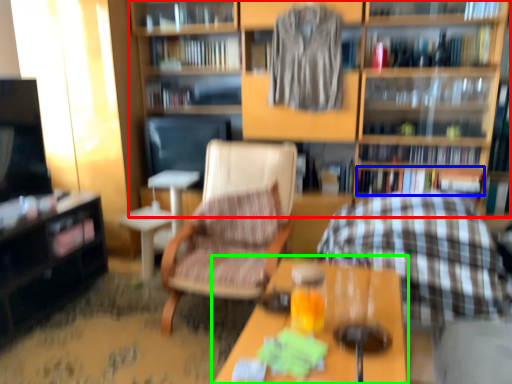
Question: Which object is the closest to the shelf (highlighted by a red box)? Choose among these: book (highlighted by a blue box) or table (highlighted by a green box).

Choices:
 (A) book
 (B) table

Answer: (A)